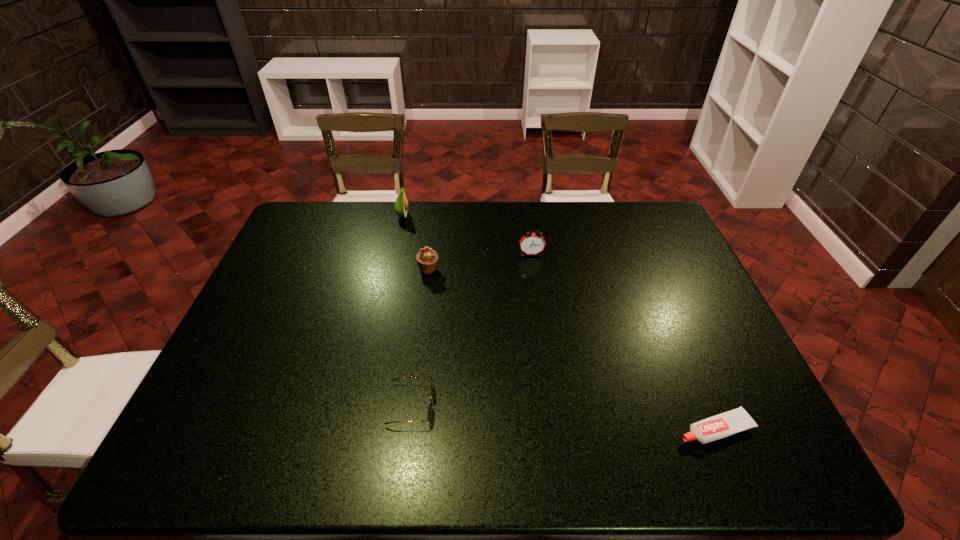
Locate an element on the screen. free point located on the back of the third nearest object is located at coordinates (434, 227).

Where is `vacant space located 0.310m on the lenses of the second shortest object`? The width and height of the screenshot is (960, 540). vacant space located 0.310m on the lenses of the second shortest object is located at coordinates pos(564,404).

The height and width of the screenshot is (540, 960). I want to click on free space located on the left of the shortest object, so click(549, 428).

What are the coordinates of `object present at the far edge` in the screenshot? It's located at (401, 204).

Where is `object at the near edge`? The image size is (960, 540). object at the near edge is located at coordinates (728, 423).

Find the location of a particular element. This screenshot has height=540, width=960. object present at the right edge is located at coordinates (728, 423).

At what (x,y) coordinates should I click in order to perform the action: click on object located at the near right corner. Please return your answer as a coordinate pair (x, y). The height and width of the screenshot is (540, 960). Looking at the image, I should click on (728, 423).

You are a GUI agent. You are given a task and a screenshot of the screen. Output one action in this format:
    pyautogui.click(x=<x>, y=<y>)
    Task: Click on the free region at the far edge
    The height and width of the screenshot is (540, 960).
    Given the screenshot: What is the action you would take?
    pyautogui.click(x=593, y=211)

Identify the location of vacant space at the near edge of the desktop. The height and width of the screenshot is (540, 960). (341, 441).

At what (x,y) coordinates should I click in order to perform the action: click on vacant region at the left edge of the desktop. Please return your answer as a coordinate pair (x, y). This screenshot has width=960, height=540. Looking at the image, I should click on (296, 276).